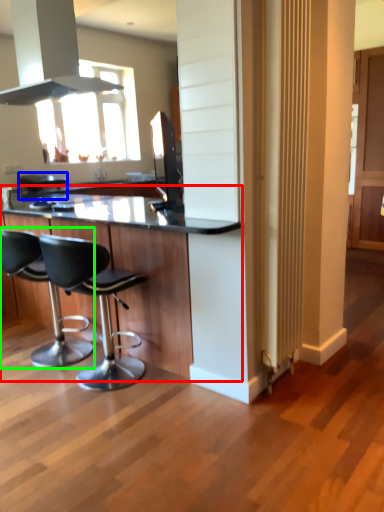
Question: Estimate the real-world distances between objects in this image. Which object is farther from table (highlighted by a red box), bar stool (highlighted by a blue box) or chair (highlighted by a green box)?

Choices:
 (A) bar stool
 (B) chair

Answer: (A)